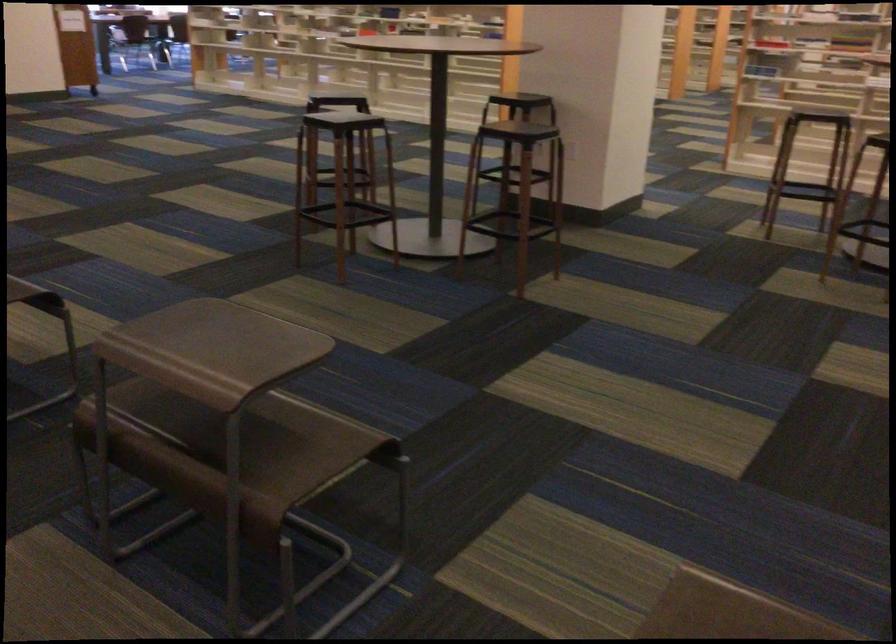
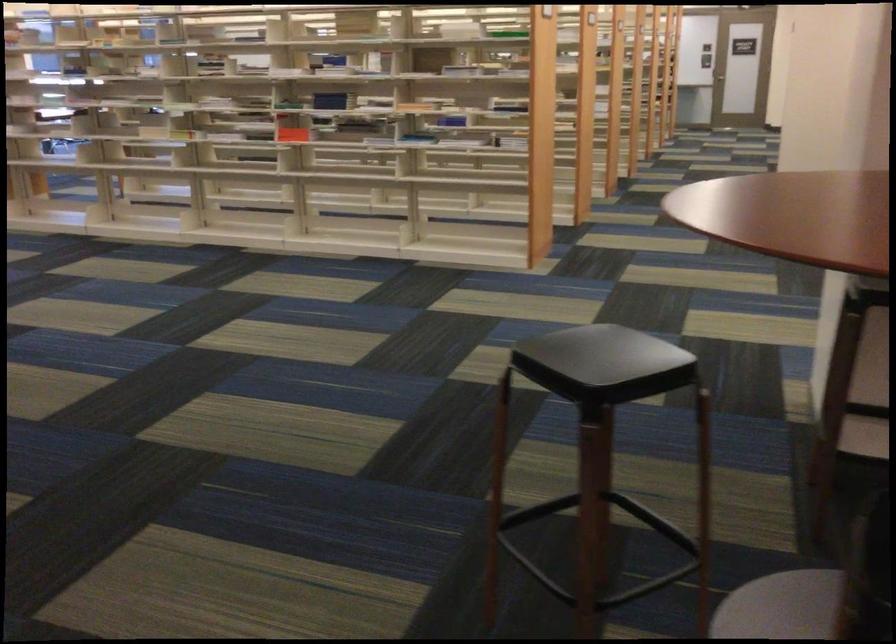
Which direction would the cameraman need to move to produce the second image?

The cameraman walked toward left, forward.